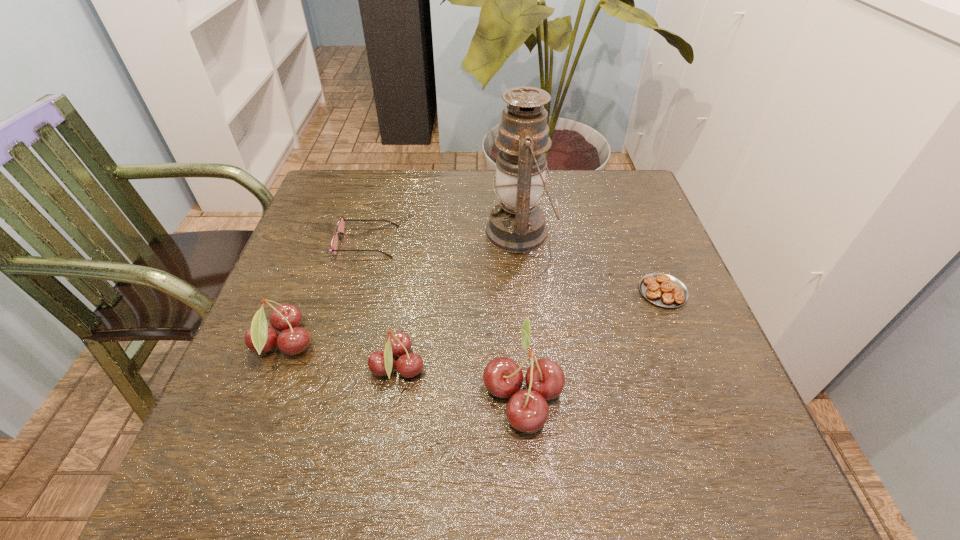
Locate an element on the screen. The image size is (960, 540). vacant space located 0.250m on the leaves of the third shortest object is located at coordinates (558, 368).

You are a GUI agent. You are given a task and a screenshot of the screen. Output one action in this format:
    pyautogui.click(x=<x>, y=<y>)
    Task: Click on the blank space located on the leaves of the rightmost cherry
    
    Given the screenshot: What is the action you would take?
    pyautogui.click(x=338, y=393)

Where is `free space located 0.230m on the leaves of the rightmost cherry`? The width and height of the screenshot is (960, 540). free space located 0.230m on the leaves of the rightmost cherry is located at coordinates (354, 393).

Find the location of a particular element. vacant space located 0.260m on the leaves of the rightmost cherry is located at coordinates (338, 393).

Locate an element on the screen. The height and width of the screenshot is (540, 960). free space located on the left of the oil lamp is located at coordinates click(x=438, y=233).

This screenshot has height=540, width=960. Identify the location of free space located 0.050m on the back of the rightmost object. (650, 260).

Locate an element on the screen. Image resolution: width=960 pixels, height=540 pixels. vacant area situated on the bridge of the second shortest object is located at coordinates (555, 242).

Identify the location of object at the far edge. The width and height of the screenshot is (960, 540). (517, 225).

Image resolution: width=960 pixels, height=540 pixels. Identify the location of cherry at the left edge. (286, 318).

Locate an element on the screen. The height and width of the screenshot is (540, 960). sunglasses located in the left edge section of the desktop is located at coordinates (341, 223).